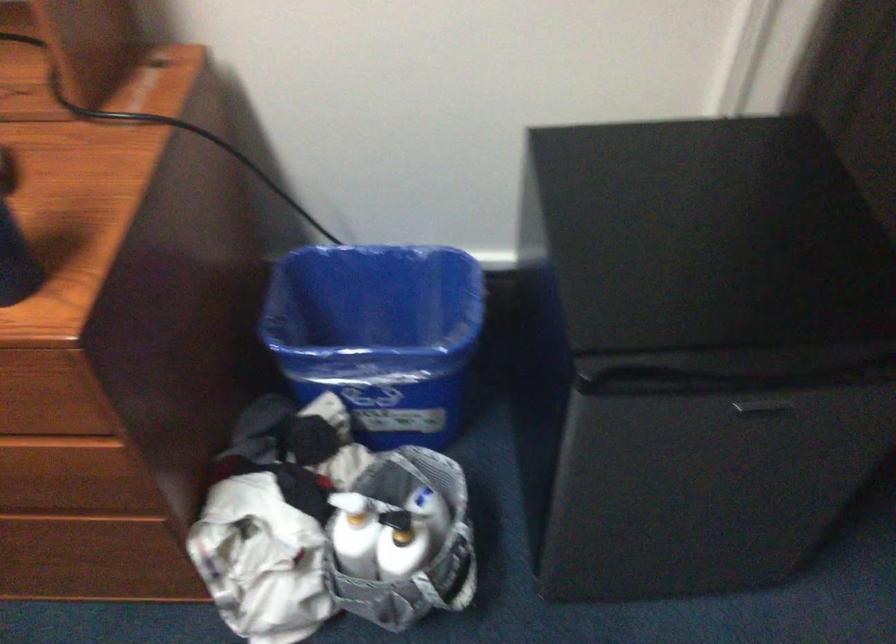
Locate an element on the screen. Image resolution: width=896 pixels, height=644 pixels. refrigerator door handle is located at coordinates (767, 404).